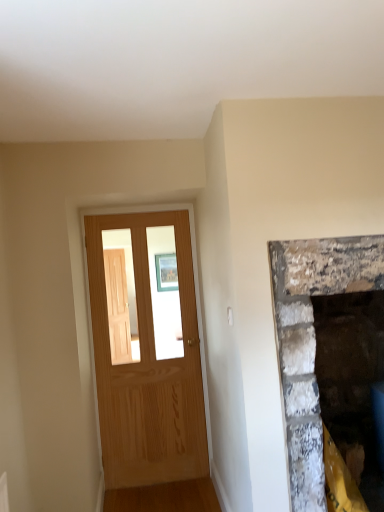
Question: Considering the positions of point (306, 487) and point (188, 445), is point (306, 487) closer or farther from the camera than point (188, 445)?

Choices:
 (A) closer
 (B) farther

Answer: (A)

Question: Is rough stone fireplace at right wider or thinner than light brown wood door at left?

Choices:
 (A) wide
 (B) thin

Answer: (A)

Question: Is rough stone fireplace at right inside the boundaries of light brown wood door at left, or outside?

Choices:
 (A) outside
 (B) inside

Answer: (A)

Question: From the image's perspective, is light brown wood door at left located above or below rough stone fireplace at right?

Choices:
 (A) above
 (B) below

Answer: (A)

Question: Is light brown wood door at left wider or thinner than rough stone fireplace at right?

Choices:
 (A) wide
 (B) thin

Answer: (B)

Question: From a real-world perspective, is light brown wood door at left physically located above or below rough stone fireplace at right?

Choices:
 (A) below
 (B) above

Answer: (B)

Question: Does point (155, 470) appear closer or farther from the camera than point (311, 350)?

Choices:
 (A) closer
 (B) farther

Answer: (B)